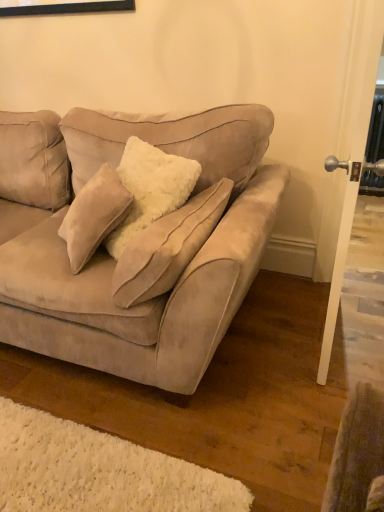
Question: Is white glossy door handle at right to the right of suede beige couch at center from the viewer's perspective?

Choices:
 (A) no
 (B) yes

Answer: (B)

Question: Does white glossy door handle at right have a lesser height compared to suede beige couch at center?

Choices:
 (A) yes
 (B) no

Answer: (B)

Question: From a real-world perspective, does white glossy door handle at right sit lower than suede beige couch at center?

Choices:
 (A) yes
 (B) no

Answer: (B)

Question: From the image's perspective, is white glossy door handle at right on suede beige couch at center?

Choices:
 (A) no
 (B) yes

Answer: (B)

Question: Is white glossy door handle at right wider than suede beige couch at center?

Choices:
 (A) yes
 (B) no

Answer: (B)

Question: Can you confirm if white glossy door handle at right is taller than suede beige couch at center?

Choices:
 (A) yes
 (B) no

Answer: (A)

Question: Is suede beige couch at center looking in the opposite direction of white glossy door handle at right?

Choices:
 (A) yes
 (B) no

Answer: (B)

Question: Can you confirm if suede beige couch at center is smaller than white glossy door handle at right?

Choices:
 (A) no
 (B) yes

Answer: (A)

Question: From the image's perspective, is suede beige couch at center located beneath white glossy door handle at right?

Choices:
 (A) no
 (B) yes

Answer: (B)

Question: Is suede beige couch at center wider than white glossy door handle at right?

Choices:
 (A) yes
 (B) no

Answer: (A)

Question: Considering the relative sizes of suede beige couch at center and white glossy door handle at right in the image provided, is suede beige couch at center taller than white glossy door handle at right?

Choices:
 (A) yes
 (B) no

Answer: (B)

Question: From a real-world perspective, is suede beige couch at center below white glossy door handle at right?

Choices:
 (A) no
 (B) yes

Answer: (B)

Question: In terms of width, does suede beige couch at center look wider or thinner when compared to white glossy door handle at right?

Choices:
 (A) thin
 (B) wide

Answer: (B)